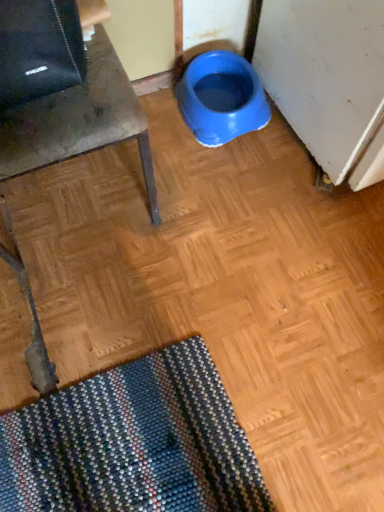
Describe the element at coordinates (221, 98) in the screenshot. The image size is (384, 512). I see `blue plastic bowl at center` at that location.

In order to face blue plastic bowl at center, should I rotate leftwards or rightwards?

Rotate right and turn 3.900 degrees.

Find the location of a particular element. blue plastic bowl at center is located at coordinates (221, 98).

Describe the element at coordinates (79, 120) in the screenshot. I see `matte gray chair at left` at that location.

Find the location of a particular element. Image resolution: width=384 pixels, height=512 pixels. matte gray chair at left is located at coordinates (79, 120).

In order to click on blue plastic bowl at center in this screenshot , I will do `click(221, 98)`.

Considering the positions of objects blue plastic bowl at center and matte gray chair at left in the image provided, who is more to the right, blue plastic bowl at center or matte gray chair at left?

Positioned to the right is blue plastic bowl at center.

Is the depth of blue plastic bowl at center less than that of matte gray chair at left?

No, blue plastic bowl at center is further to the viewer.

Is point (260, 83) behind point (49, 111)?

Yes, it is behind point (49, 111).

From the picture: From the image's perspective, does blue plastic bowl at center appear lower than matte gray chair at left?

Incorrect, from the image's perspective, blue plastic bowl at center is higher than matte gray chair at left.

From a real-world perspective, is blue plastic bowl at center positioned under matte gray chair at left based on gravity?

Correct, in the physical world, blue plastic bowl at center is lower than matte gray chair at left.

Which object is wider, blue plastic bowl at center or matte gray chair at left?

matte gray chair at left.

Considering the relative sizes of blue plastic bowl at center and matte gray chair at left in the image provided, is blue plastic bowl at center taller than matte gray chair at left?

No, blue plastic bowl at center is not taller than matte gray chair at left.

Looking at the image, does blue plastic bowl at center seem bigger or smaller compared to matte gray chair at left?

Considering their sizes, blue plastic bowl at center takes up less space than matte gray chair at left.

Is matte gray chair at left located within blue plastic bowl at center?

No, matte gray chair at left is not surrounded by blue plastic bowl at center.

Is blue plastic bowl at center far away from matte gray chair at left?

blue plastic bowl at center is near matte gray chair at left, not far away.

Could you tell me if blue plastic bowl at center is turned towards matte gray chair at left?

No, blue plastic bowl at center is not aimed at matte gray chair at left.

Locate an element on the screen. toilet below the matte gray chair at left (from a real-world perspective) is located at coordinates 221,98.

Which object is positioned more to the left, matte gray chair at left or blue plastic bowl at center?

Positioned to the left is matte gray chair at left.

Consider the image. Between matte gray chair at left and blue plastic bowl at center, which one is positioned in front?

matte gray chair at left is in front.

Which is closer, (104, 76) or (221, 63)?

Point (104, 76) appears to be closer to the viewer than point (221, 63).

From the image's perspective, is matte gray chair at left above blue plastic bowl at center?

Result: No.

From a real-world perspective, is matte gray chair at left physically below blue plastic bowl at center?

No, from a real-world perspective, matte gray chair at left is not beneath blue plastic bowl at center.

Can you confirm if matte gray chair at left is thinner than blue plastic bowl at center?

No.

Can you confirm if matte gray chair at left is taller than blue plastic bowl at center?

Yes.

Between matte gray chair at left and blue plastic bowl at center, which one has smaller size?

blue plastic bowl at center is smaller.

Can blue plastic bowl at center be found inside matte gray chair at left?

Definitely not — blue plastic bowl at center is not inside matte gray chair at left.

Are matte gray chair at left and blue plastic bowl at center far apart?

No, matte gray chair at left is not far from blue plastic bowl at center.

Looking at this image, is blue plastic bowl at center at the back of matte gray chair at left?

matte gray chair at left is not turned away from blue plastic bowl at center.

What's the angular difference between matte gray chair at left and blue plastic bowl at center's facing directions?

0.421 degrees.

I want to click on furniture in front of the blue plastic bowl at center, so click(79, 120).

Locate an element on the screen. The width and height of the screenshot is (384, 512). furniture on the left of blue plastic bowl at center is located at coordinates (79, 120).

Locate an element on the screen. This screenshot has width=384, height=512. furniture in front of the blue plastic bowl at center is located at coordinates (79, 120).